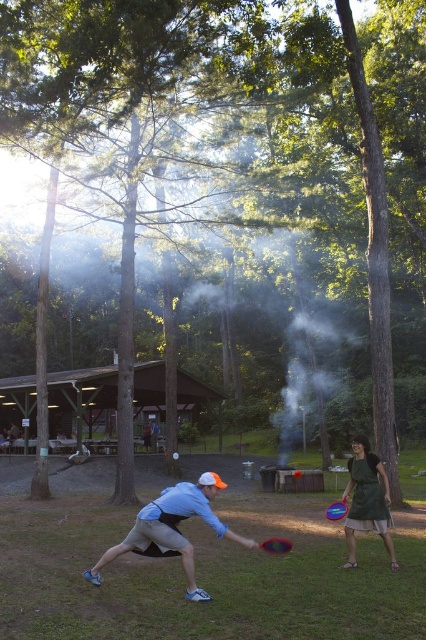
Question: Which is nearer to the red plastic frisbee at center?

Choices:
 (A) dark green fabric apron at center
 (B) denim jacket at center

Answer: (A)

Question: Among these objects, which one is farthest from the camera?

Choices:
 (A) red plastic frisbee at lower center
 (B) dark green fabric apron at center
 (C) red plastic frisbee at center

Answer: (C)

Question: Is dark green fabric apron at center further to the viewer compared to red plastic frisbee at center?

Choices:
 (A) yes
 (B) no

Answer: (B)

Question: Where is dark green fabric apron at center located in relation to red plastic frisbee at center in the image?

Choices:
 (A) right
 (B) left

Answer: (A)

Question: Which object is farther from the camera taking this photo?

Choices:
 (A) red plastic frisbee at center
 (B) light blue fabric shirt at center
 (C) red plastic frisbee at lower center
 (D) denim jacket at center

Answer: (D)

Question: Is dark green fabric apron at center thinner than red plastic frisbee at lower center?

Choices:
 (A) no
 (B) yes

Answer: (A)